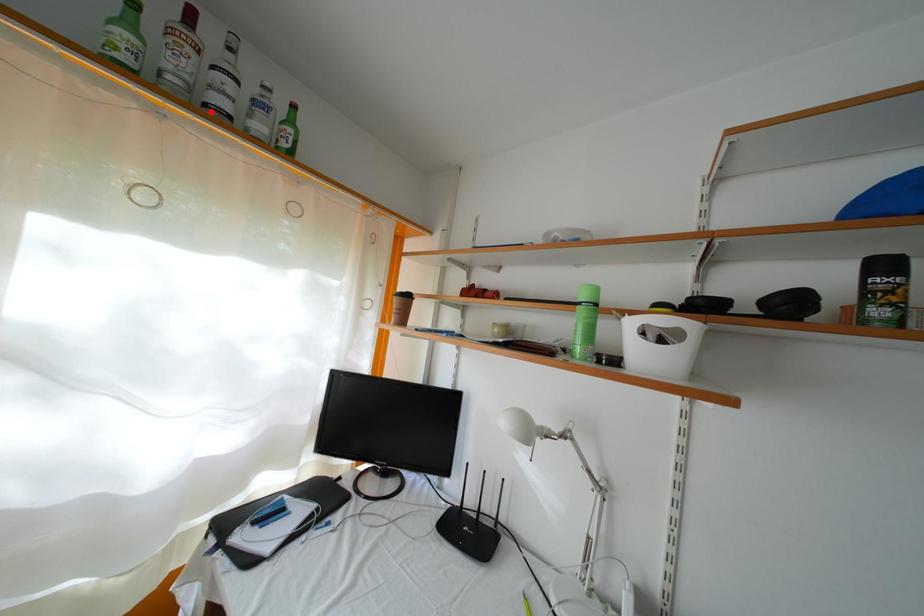
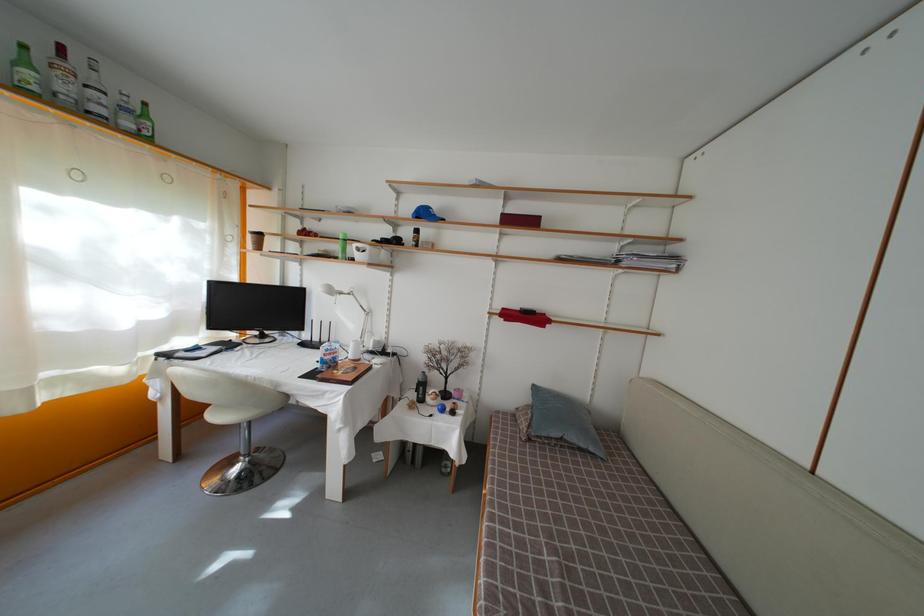
Where in the second image is the point corresponding to the highlighted location from the first image?

(94, 119)